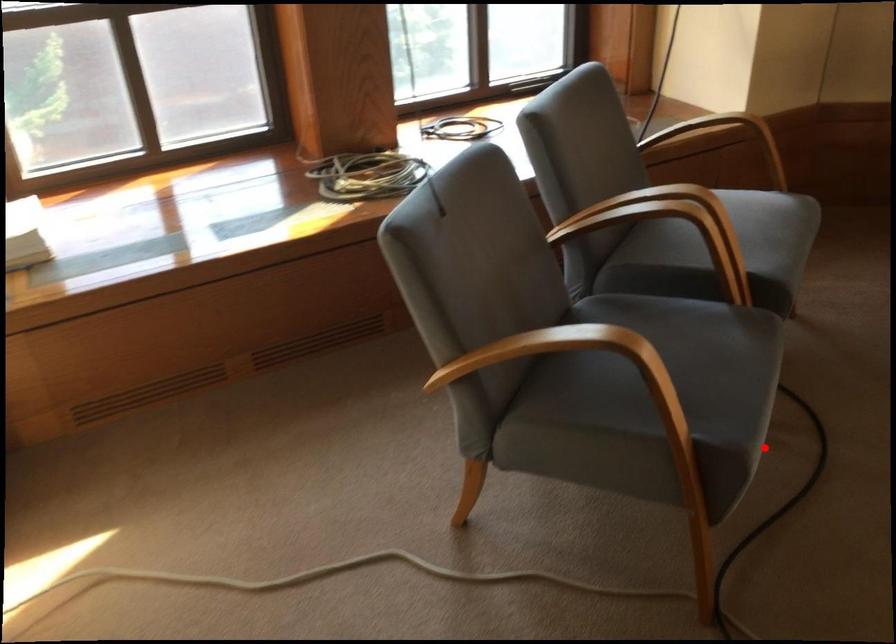
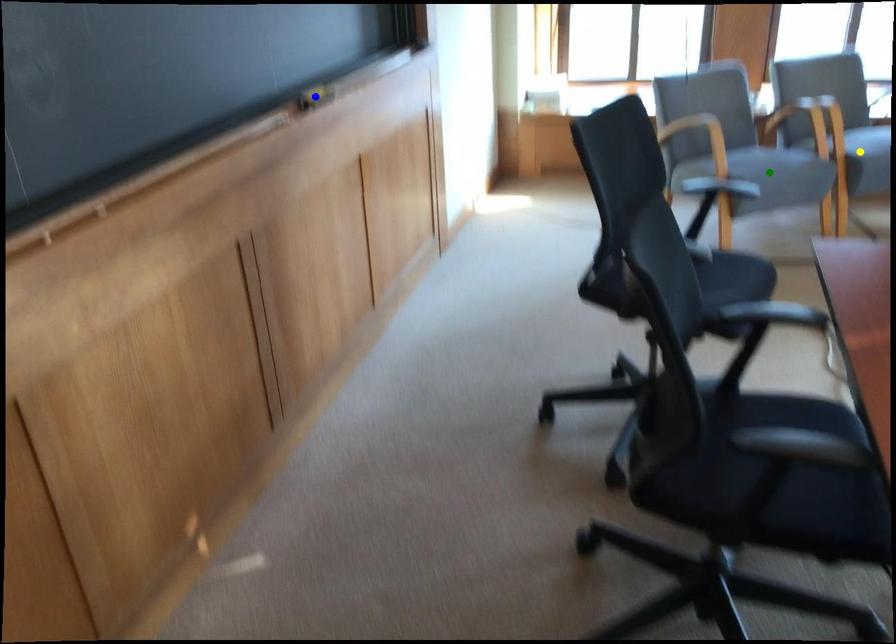
Question: I am providing you with two images of the same scene from different viewpoints. A red point is marked on the first image. You are given multiple points on the second image. Which point in image 2 is actually the same real-world point as the red point in image 1?

Choices:
 (A) green point
 (B) yellow point
 (C) blue point

Answer: (A)